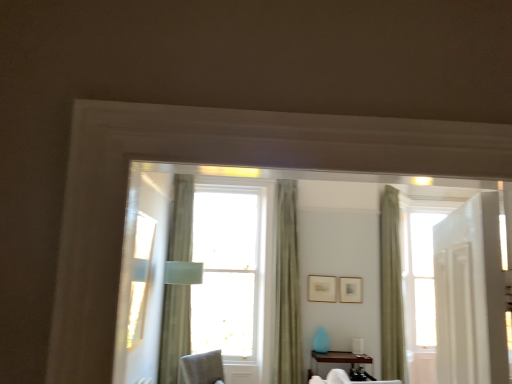
Question: Is matte silver picture frame at center, which is the 1th picture frame from right to left, in front of or behind wooden picture frame at center, which appears as the second picture frame when viewed from the right, in the image?

Choices:
 (A) behind
 (B) front

Answer: (A)

Question: From a real-world perspective, is matte silver picture frame at center, which appears as the 2th picture frame when viewed from the left, positioned above or below wooden picture frame at center, which appears as the second picture frame when viewed from the right?

Choices:
 (A) above
 (B) below

Answer: (B)

Question: Considering the real-world distances, which object is farthest from the transparent glass window at center?

Choices:
 (A) light beige fabric curtain at center, the 1th curtain viewed from the left
 (B) wooden picture frame at center, the first picture frame from the left
 (C) green fabric curtain at center, the 2th curtain in the left-to-right sequence
 (D) brown wood table at lower center
 (E) matte silver picture frame at center, which appears as the 2th picture frame when viewed from the left

Answer: (A)

Question: Which object is positioned closest to the brown wood table at lower center?

Choices:
 (A) transparent glass window at center
 (B) light beige fabric curtain at center, placed as the 3th curtain when sorted from right to left
 (C) green fabric curtain at right, which appears as the first curtain when viewed from the right
 (D) wooden picture frame at center, which appears as the second picture frame when viewed from the right
 (E) matte silver picture frame at center, which is the 1th picture frame from right to left

Answer: (E)